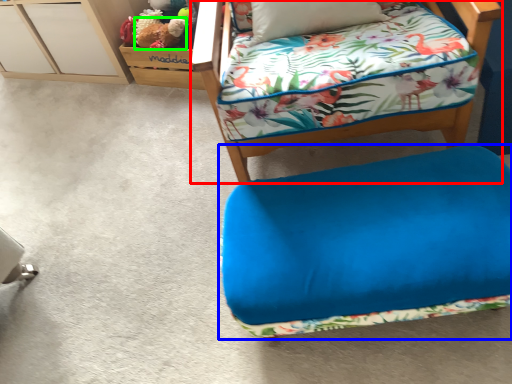
Question: Which object is positioned farthest from furniture (highlighted by a red box)? Select from furniture (highlighted by a blue box) and animal (highlighted by a green box).

Choices:
 (A) furniture
 (B) animal

Answer: (B)